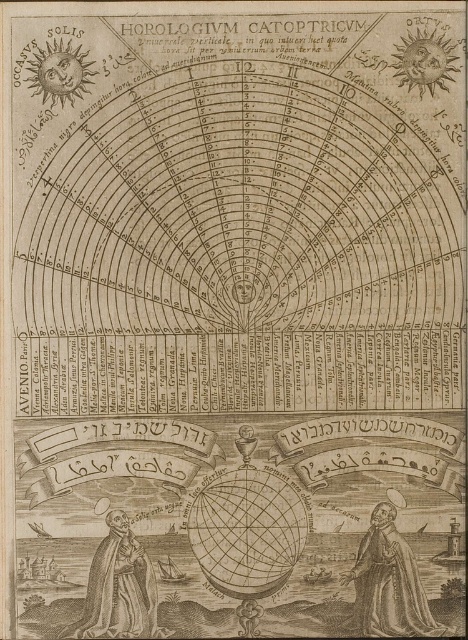
Who is higher up, smooth brown robe at lower right or wooden statue at lower left?

smooth brown robe at lower right

Which is more to the left, smooth brown robe at lower right or wooden statue at lower left?

Positioned to the left is wooden statue at lower left.

Identify the location of smooth brown robe at lower right. This screenshot has height=640, width=468. (388, 582).